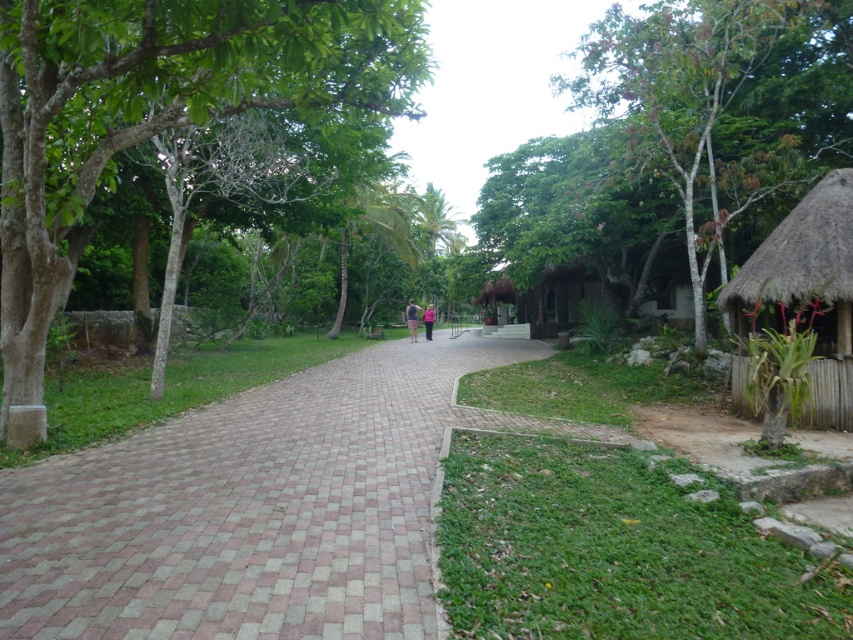
Question: Which point is farther to the camera?

Choices:
 (A) (0, 340)
 (B) (848, 275)
 (C) (625, 88)

Answer: (C)

Question: Is brick paved path at center bigger than green leafy tree at upper right?

Choices:
 (A) yes
 (B) no

Answer: (B)

Question: Does green leafy tree at upper right have a greater width compared to thatched bamboo hut at right?

Choices:
 (A) yes
 (B) no

Answer: (A)

Question: Among these objects, which one is nearest to the camera?

Choices:
 (A) green leafy tree at upper right
 (B) thatched bamboo hut at right
 (C) brick paved path at center

Answer: (C)

Question: Can you confirm if green leafy tree at upper right is thinner than thatched bamboo hut at right?

Choices:
 (A) yes
 (B) no

Answer: (B)

Question: Based on their relative distances, which object is farther from the thatched bamboo hut at right?

Choices:
 (A) green leafy tree at left
 (B) brick paved path at center

Answer: (A)